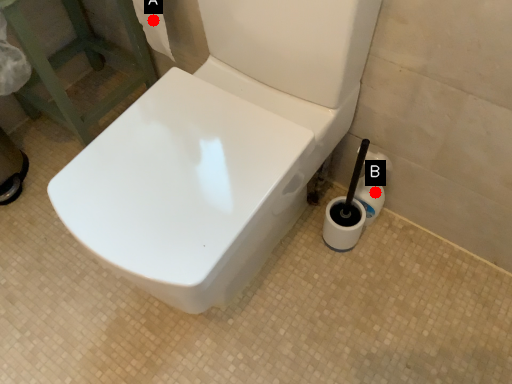
Question: Two points are circled on the image, labeled by A and B beside each circle. Which point is closer to the camera?

Choices:
 (A) A is closer
 (B) B is closer

Answer: (B)